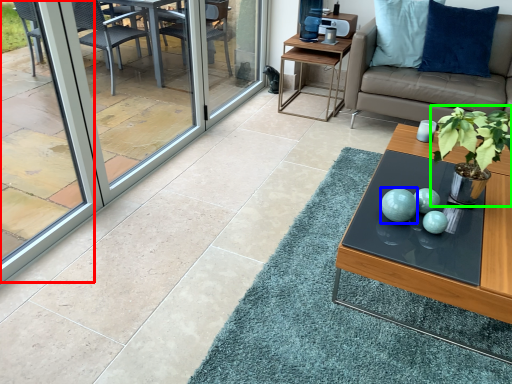
Question: Which is nearer to the window screen (highlighted by a red box)? turquoise (highlighted by a blue box) or houseplant (highlighted by a green box).

Choices:
 (A) turquoise
 (B) houseplant

Answer: (A)